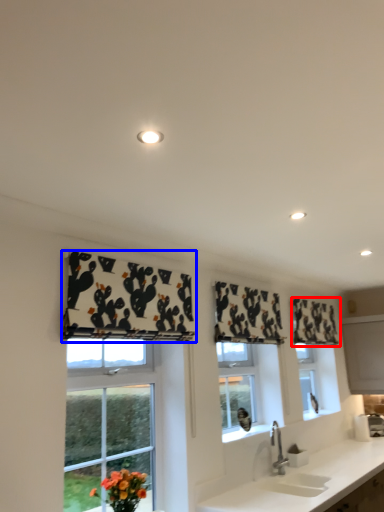
Question: Which of the following is the farthest to the observer, curtain (highlighted by a red box) or curtain (highlighted by a blue box)?

Choices:
 (A) curtain
 (B) curtain

Answer: (A)